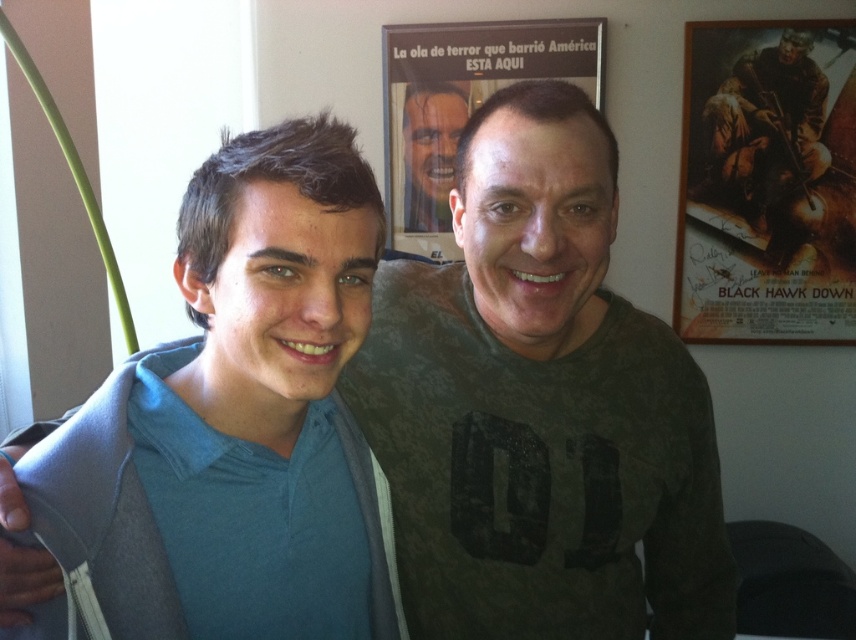
You are a photographer adjusting your camera settings. You notice the blue cotton shirt at left and the matte black face at center in your frame. Which object is positioned lower in the image?

The blue cotton shirt at left is positioned lower than the matte black face at center in the image.

You are a photographer setting up for a group photo. You notice the dark green textured shirt at center and the blue cotton shirt at left. Which shirt is positioned closer to the right side of the image?

The dark green textured shirt at center is to the right of the blue cotton shirt at left, so it is positioned closer to the right side of the image.